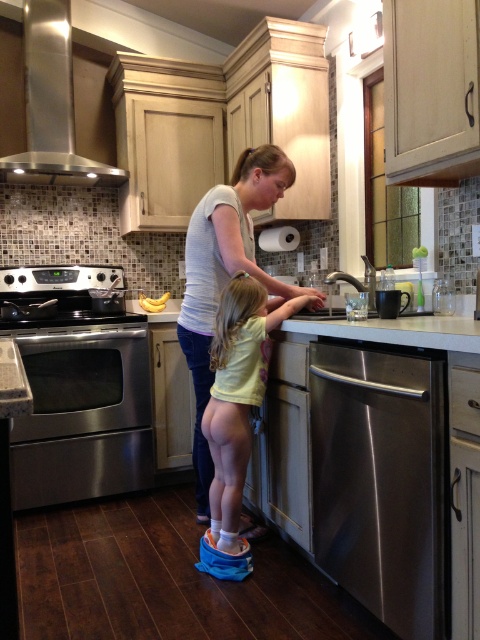
Question: Which point is farther from the camera taking this photo?

Choices:
 (A) (151, 448)
 (B) (57, 179)
 (C) (360, 518)

Answer: (B)

Question: Which point appears farthest from the camera in this image?

Choices:
 (A) (39, 355)
 (B) (36, 109)
 (C) (440, 368)

Answer: (B)

Question: Can you confirm if stainless steel dishwasher at lower right is bigger than yellow matte bananas at center?

Choices:
 (A) no
 (B) yes

Answer: (B)

Question: Can you confirm if yellow matte shirt at center is wider than stainless steel exhaust hood at upper left?

Choices:
 (A) no
 (B) yes

Answer: (A)

Question: Which of the following is the closest to the observer?

Choices:
 (A) (149, 300)
 (B) (411, 456)

Answer: (B)

Question: Is stainless steel exhaust hood at upper left further to camera compared to yellow matte bananas at center?

Choices:
 (A) yes
 (B) no

Answer: (B)